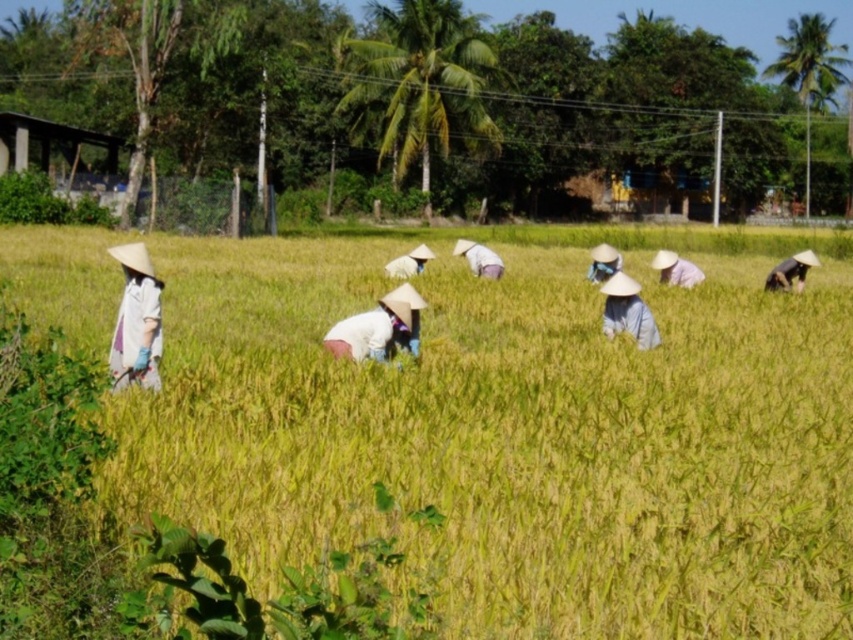
You are a photographer trying to capture a clear shot of the light blue fabric hat at center and the white fabric hat at center in the rice field scene. Since the hats are at the same center position, which hat will appear taller in your photo?

The light blue fabric hat at center appears taller than the white fabric hat at center in the photo because the light blue fabric hat at center has a greater height compared to white fabric hat at center.

You are standing in a rice field and see a white cotton hat at left. If you want to reach the hat quickly, should you move forward or backward?

The white cotton hat at left is 8.41 meters away from viewer, so you should move forward to reach it quickly.

You are a photographer trying to capture a closeup of the white cotton hat at center and the blue fabric headscarf at center. Which one would you need to get closer to in order to fill the frame?

The white cotton hat at center has a smaller size compared to blue fabric headscarf at center, so you would need to get closer to the white cotton hat at center to fill the frame.